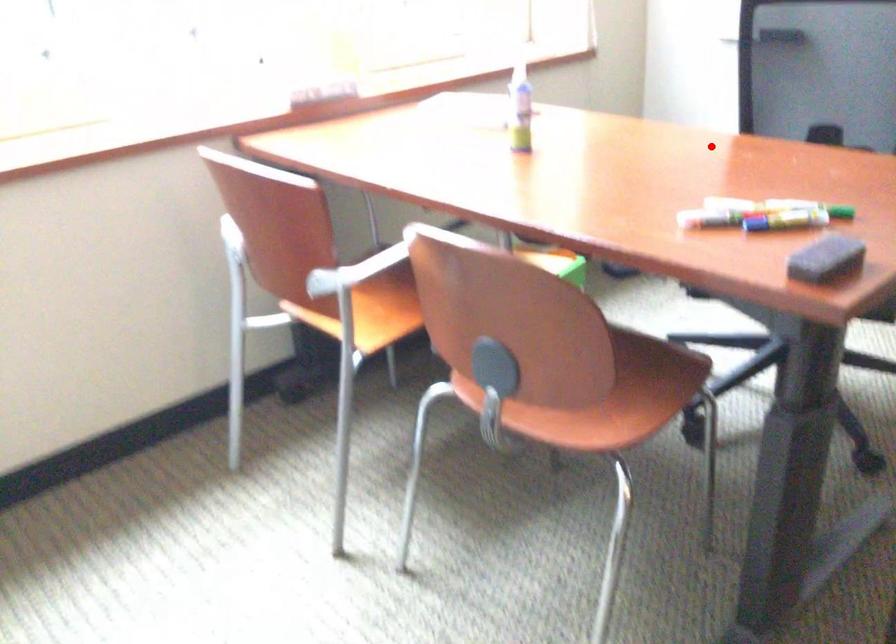
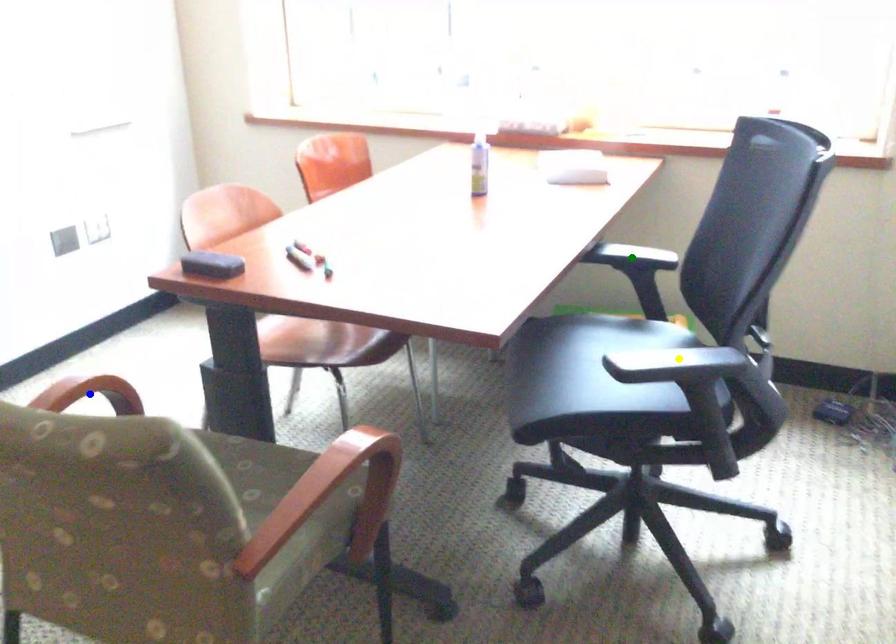
Question: I am providing you with two images of the same scene from different viewpoints. A red point is marked on the first image. You are given multiple points on the second image. Which mark in image 2 goes with the point in image 1?

Choices:
 (A) blue point
 (B) green point
 (C) yellow point

Answer: (B)